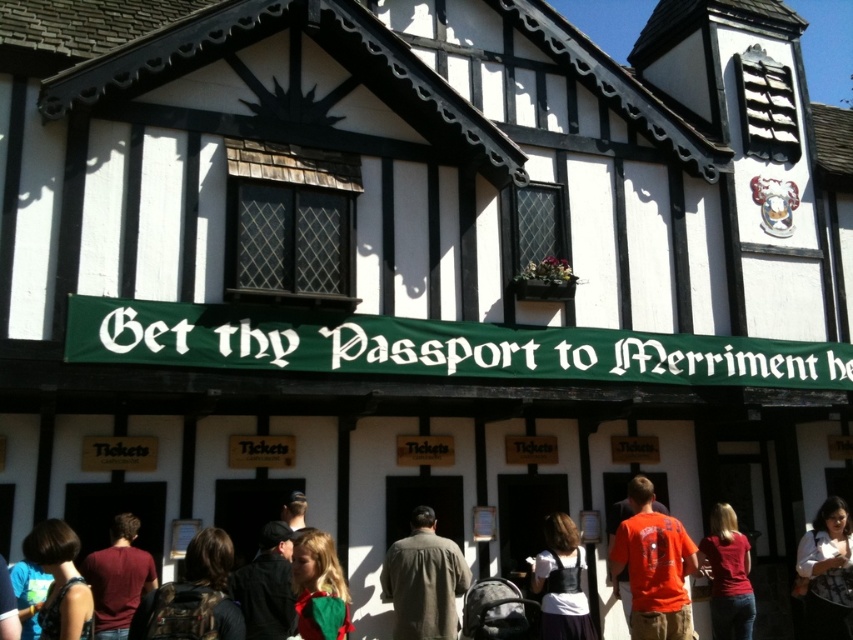
Is dark brown backpack at lower left below dark brown hair at lower left?

Actually, dark brown backpack at lower left is above dark brown hair at lower left.

Consider the image. Who is higher up, dark brown backpack at lower left or dark brown hair at lower left?

dark brown backpack at lower left is above.

Does point (142, 611) come farther from viewer compared to point (64, 593)?

No, it is in front of (64, 593).

Image resolution: width=853 pixels, height=640 pixels. Identify the location of dark brown backpack at lower left. (194, 593).

In the scene shown: Who is lower down, matte maroon shirt at center or dark brown leather hat at lower center?

Positioned lower is matte maroon shirt at center.

The width and height of the screenshot is (853, 640). Describe the element at coordinates (119, 579) in the screenshot. I see `matte maroon shirt at center` at that location.

Looking at this image, who is more distant from viewer, (100, 566) or (296, 509)?

The point (296, 509) is more distant.

Locate an element on the screen. The height and width of the screenshot is (640, 853). matte maroon shirt at center is located at coordinates (119, 579).

Who is higher up, green knitted sweater at center or dark brown leather hat at lower center?

dark brown leather hat at lower center is higher up.

Can you confirm if green knitted sweater at center is taller than dark brown leather hat at lower center?

Yes, green knitted sweater at center is taller than dark brown leather hat at lower center.

The width and height of the screenshot is (853, 640). What do you see at coordinates (318, 588) in the screenshot?
I see `green knitted sweater at center` at bounding box center [318, 588].

The width and height of the screenshot is (853, 640). I want to click on green knitted sweater at center, so click(318, 588).